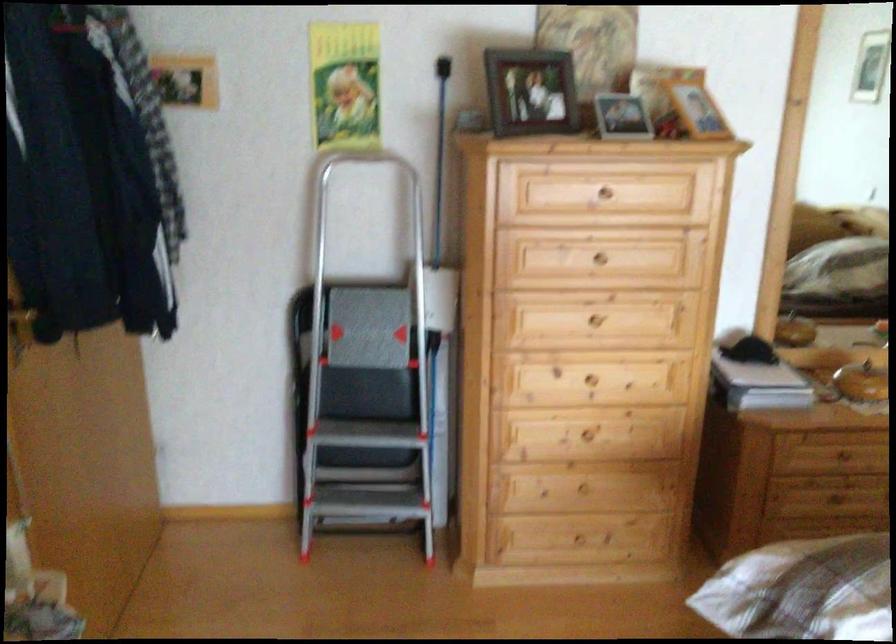
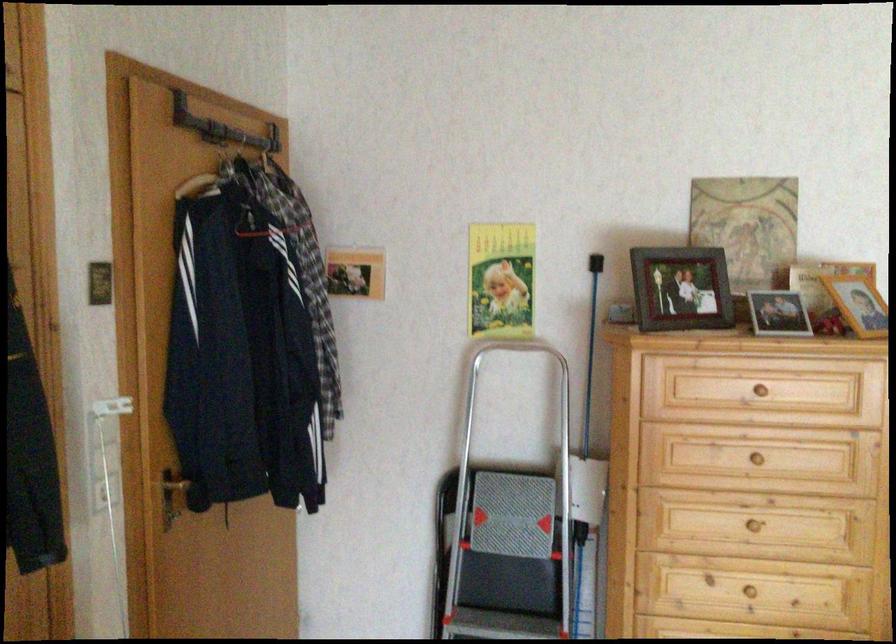
Find the pixel in the second image that matches (x=686, y=111) in the first image.

(857, 304)